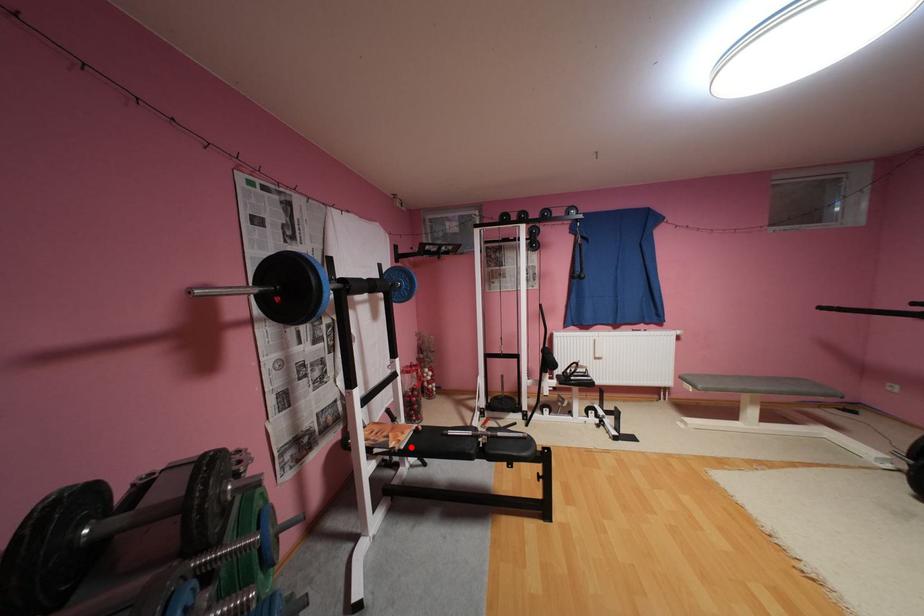
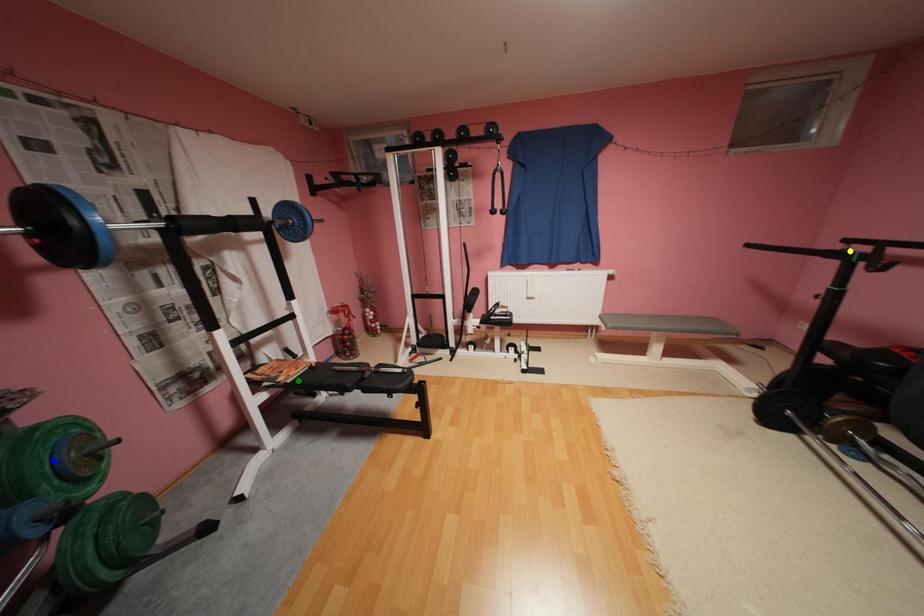
Question: I am providing you with two images of the same scene from different viewpoints. A red point is marked on the first image. You are given multiple points on the second image. Which point in image 2 is actually the same real-world point as the red point in image 1?

Choices:
 (A) blue point
 (B) yellow point
 (C) green point

Answer: (C)